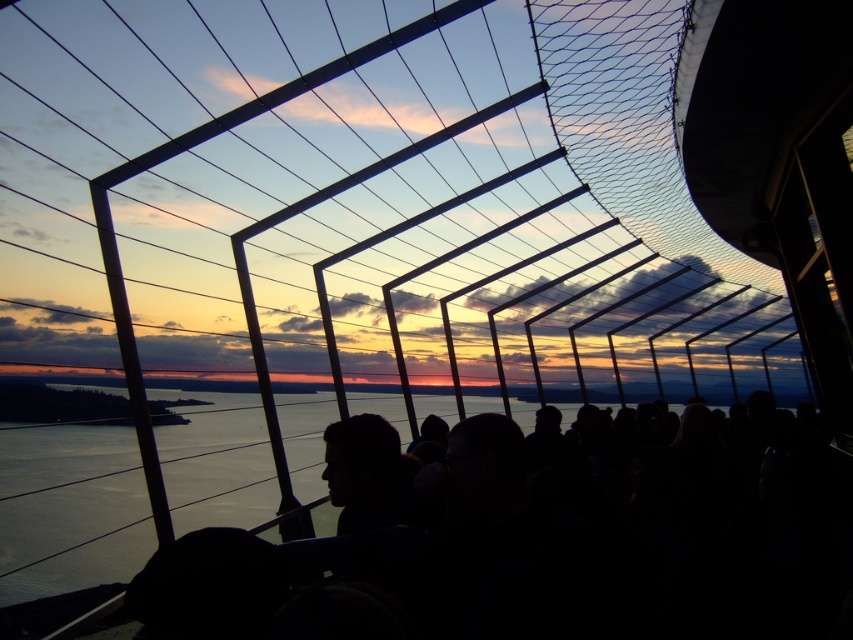
You are a guest at this sunset viewing spot. You see the transparent glass water at lower left and the dark hair at center. Which object is positioned lower in the scene?

The transparent glass water at lower left is located below dark hair at center, so it is positioned lower in the scene.

From the picture: You are standing inside the structure and want to pour water from a bottle into the transparent glass water at lower left. Where exactly should you aim to pour the water?

The transparent glass water at lower left is located at coordinates point (68, 509), so you should aim for that specific point to pour the water.